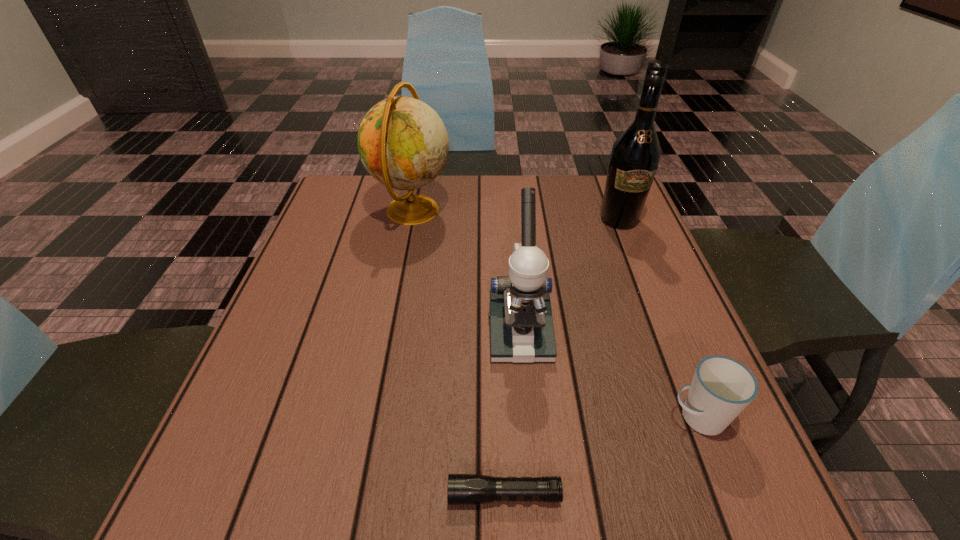
Locate an element on the screen. The width and height of the screenshot is (960, 540). wine bottle that is at the right edge is located at coordinates (635, 155).

Identify the location of cup located at the right edge. The image size is (960, 540). (721, 388).

You are a GUI agent. You are given a task and a screenshot of the screen. Output one action in this format:
    pyautogui.click(x=<x>, y=<y>)
    Task: Click on the object located in the far left corner section of the desktop
    This screenshot has width=960, height=540.
    Given the screenshot: What is the action you would take?
    tap(403, 143)

Locate an element on the screen. This screenshot has width=960, height=540. object present at the far right corner is located at coordinates (635, 155).

Where is `vacant area at the far edge of the desktop`? This screenshot has height=540, width=960. vacant area at the far edge of the desktop is located at coordinates (486, 189).

Locate an element on the screen. vacant space at the near edge is located at coordinates (504, 461).

The height and width of the screenshot is (540, 960). What are the coordinates of `free space at the left edge of the desktop` in the screenshot? It's located at (348, 333).

At what (x,y) coordinates should I click in order to perform the action: click on vacant space at the right edge of the desktop. Please return your answer as a coordinate pair (x, y). This screenshot has width=960, height=540. Looking at the image, I should click on (679, 443).

In the image, there is a desktop. Identify the location of free space at the far left corner. The height and width of the screenshot is (540, 960). (340, 212).

Identify the location of vacant space at the far right corner of the desktop. (596, 220).